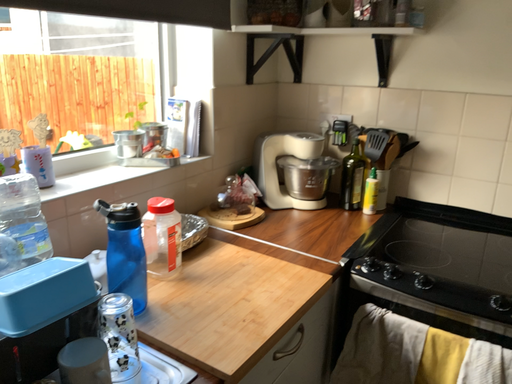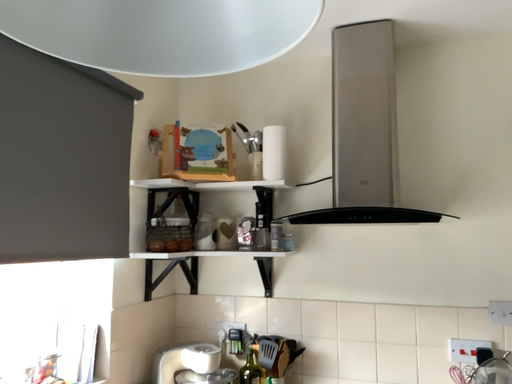
Question: Which way did the camera rotate in the video?

Choices:
 (A) rotated left
 (B) rotated right

Answer: (B)